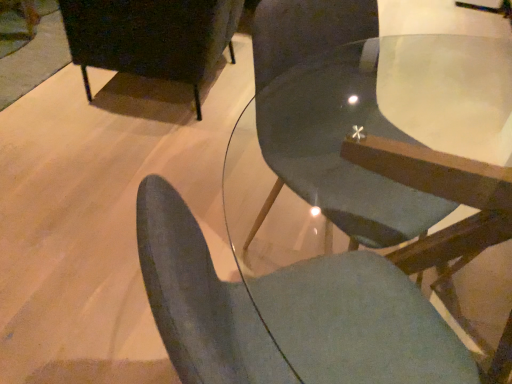
Question: Does matte gray chair at center, the first chair when ordered from front to back, have a greater height compared to matte black chair at upper left, positioned as the first chair in back-to-front order?

Choices:
 (A) no
 (B) yes

Answer: (B)

Question: Is matte black chair at upper left, the third chair viewed from the front, a part of matte gray chair at center, the first chair when ordered from front to back?

Choices:
 (A) no
 (B) yes

Answer: (A)

Question: Is matte gray chair at center, which appears as the 3th chair when viewed from the back, wider than matte black chair at upper left, the third chair viewed from the front?

Choices:
 (A) yes
 (B) no

Answer: (B)

Question: Can you confirm if matte gray chair at center, which appears as the 3th chair when viewed from the back, is positioned to the left of matte black chair at upper left, the third chair viewed from the front?

Choices:
 (A) yes
 (B) no

Answer: (B)

Question: From the image's perspective, would you say matte gray chair at center, which appears as the 3th chair when viewed from the back, is shown under matte black chair at upper left, the third chair viewed from the front?

Choices:
 (A) yes
 (B) no

Answer: (A)

Question: From a real-world perspective, is matte gray chair at center, which is the second chair from back to front, above or below matte gray chair at center, the first chair when ordered from front to back?

Choices:
 (A) above
 (B) below

Answer: (A)

Question: Considering the positions of point (352, 31) and point (209, 372), is point (352, 31) closer or farther from the camera than point (209, 372)?

Choices:
 (A) farther
 (B) closer

Answer: (A)

Question: Considering the positions of matte gray chair at center, acting as the 2th chair starting from the front, and matte gray chair at center, the first chair when ordered from front to back, in the image, is matte gray chair at center, acting as the 2th chair starting from the front, bigger or smaller than matte gray chair at center, the first chair when ordered from front to back,?

Choices:
 (A) small
 (B) big

Answer: (B)

Question: From the image's perspective, relative to matte gray chair at center, the first chair when ordered from front to back, is matte gray chair at center, which is the second chair from back to front, above or below?

Choices:
 (A) above
 (B) below

Answer: (A)

Question: Is matte black chair at upper left, the third chair viewed from the front, in front of or behind matte gray chair at center, which appears as the 3th chair when viewed from the back, in the image?

Choices:
 (A) front
 (B) behind

Answer: (B)

Question: From a real-world perspective, is matte black chair at upper left, positioned as the first chair in back-to-front order, positioned above or below matte gray chair at center, which appears as the 3th chair when viewed from the back?

Choices:
 (A) above
 (B) below

Answer: (B)

Question: Is matte black chair at upper left, the third chair viewed from the front, situated inside matte gray chair at center, the first chair when ordered from front to back, or outside?

Choices:
 (A) inside
 (B) outside

Answer: (B)

Question: From the image's perspective, is matte black chair at upper left, the third chair viewed from the front, above or below matte gray chair at center, the first chair when ordered from front to back?

Choices:
 (A) above
 (B) below

Answer: (A)

Question: Considering the relative positions of matte gray chair at center, which appears as the 3th chair when viewed from the back, and matte gray chair at center, which is the second chair from back to front, in the image provided, is matte gray chair at center, which appears as the 3th chair when viewed from the back, to the left or to the right of matte gray chair at center, which is the second chair from back to front,?

Choices:
 (A) right
 (B) left

Answer: (B)

Question: From the image's perspective, is matte gray chair at center, the first chair when ordered from front to back, located above or below matte gray chair at center, acting as the 2th chair starting from the front?

Choices:
 (A) above
 (B) below

Answer: (B)